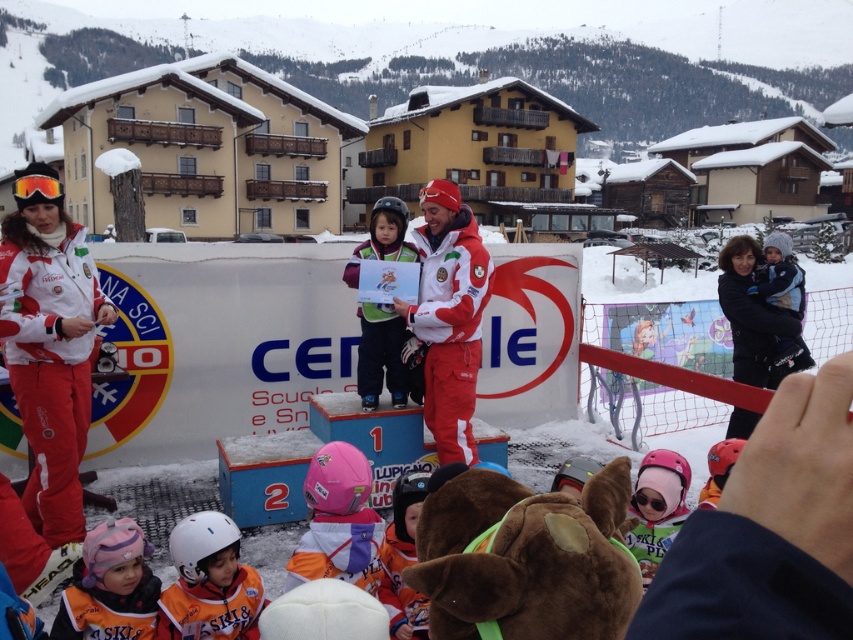
Question: Can you confirm if pink fleece hat at lower left is bigger than pink matte helmet at center?

Choices:
 (A) no
 (B) yes

Answer: (A)

Question: Which is nearer to the matte red jacket at center?

Choices:
 (A) orange ski suit at lower left
 (B) green fabric jacket at center

Answer: (B)

Question: Which point is farther from the camera taking this photo?

Choices:
 (A) (389, 212)
 (B) (199, 529)
 (C) (647, 544)
 (D) (112, 524)

Answer: (A)

Question: Is orange ski suit at lower left to the right of green fabric jacket at center from the viewer's perspective?

Choices:
 (A) no
 (B) yes

Answer: (A)

Question: Does green fabric jacket at center appear over pink matte helmet at center?

Choices:
 (A) yes
 (B) no

Answer: (A)

Question: Which point appears farthest from the camera in this image?

Choices:
 (A) [345, 266]
 (B) [257, 604]
 (C) [665, 508]
 (D) [775, 257]

Answer: (D)